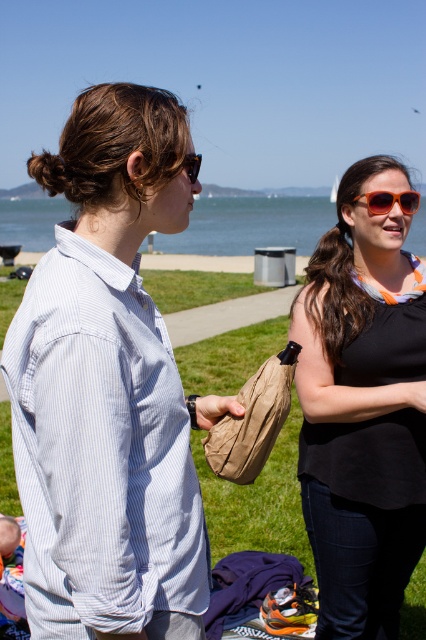
From the picture: You are standing in the park and want to take a photo of the light blue striped shirt at left and the green grass at center. Which object will appear larger in the photo?

The light blue striped shirt at left will appear larger in the photo because it is closer to the viewer than the green grass at center.

Looking at this image, you are standing at point (377, 202) and want to walk to the water. There is another point at (333, 589). Which point is closer to the water?

Point (333, 589) is behind point (377, 202), so the point (377, 202) is closer to the water.

Looking at this image, you are standing in the park and see the matte black tank top at center and the orange plastic sunglasses at center. Which object is closer to you?

The matte black tank top at center is closer to you because it is in front of the orange plastic sunglasses at center.